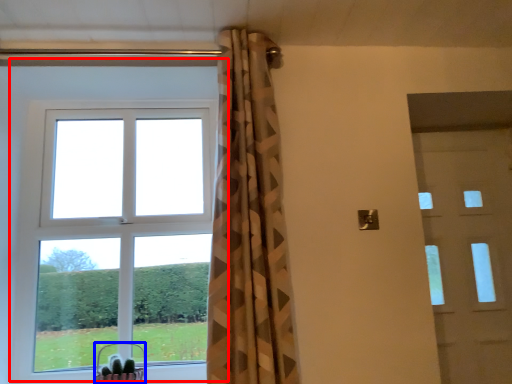
Question: Among these objects, which one is nearest to the camera, window (highlighted by a red box) or basket (highlighted by a blue box)?

Choices:
 (A) window
 (B) basket

Answer: (B)